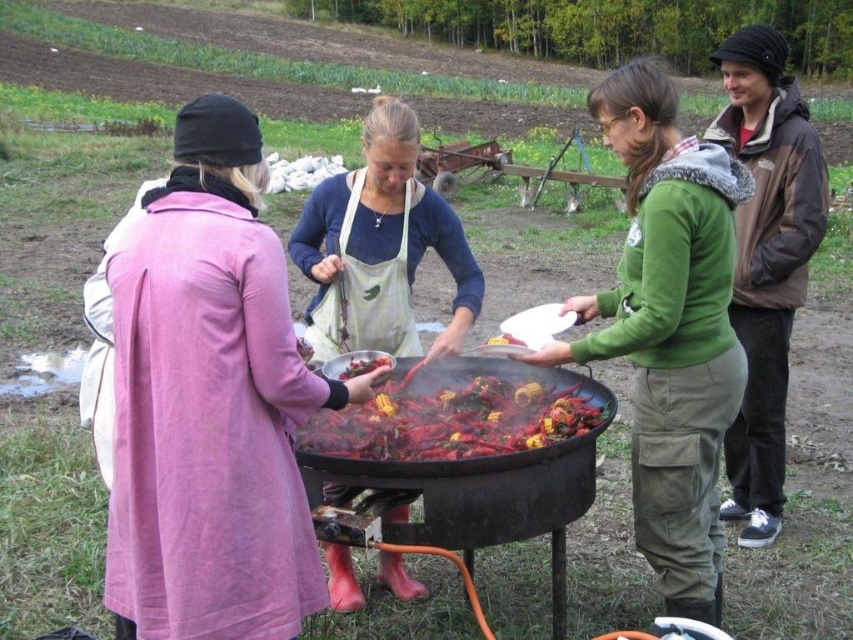
Who is more distant from viewer, (701, 392) or (323, 244)?

The point (323, 244) is behind.

Is green fleece jacket at center smaller than white apron at center?

Incorrect, green fleece jacket at center is not smaller in size than white apron at center.

Which is behind, point (650, 346) or point (444, 339)?

The point (444, 339) is more distant.

Where is `green fleece jacket at center`? This screenshot has width=853, height=640. green fleece jacket at center is located at coordinates (669, 328).

Consider the image. Measure the distance between pink fabric coat at center and green fleece jacket at center.

pink fabric coat at center and green fleece jacket at center are 3.97 feet apart.

Does pink fabric coat at center have a lesser width compared to green fleece jacket at center?

Indeed, pink fabric coat at center has a lesser width compared to green fleece jacket at center.

Who is more forward, (216, 538) or (671, 108)?

Positioned in front is point (216, 538).

The width and height of the screenshot is (853, 640). What are the coordinates of `pink fabric coat at center` in the screenshot? It's located at (209, 403).

Who is more distant from viewer, [143,362] or [306,458]?

Point [306,458]

The width and height of the screenshot is (853, 640). What are the coordinates of `pink fabric coat at center` in the screenshot? It's located at (209, 403).